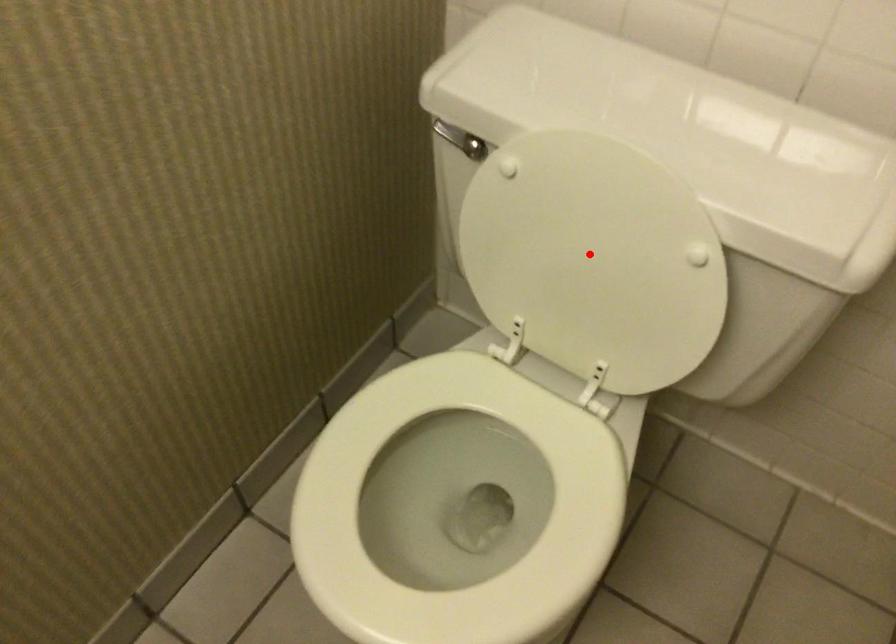
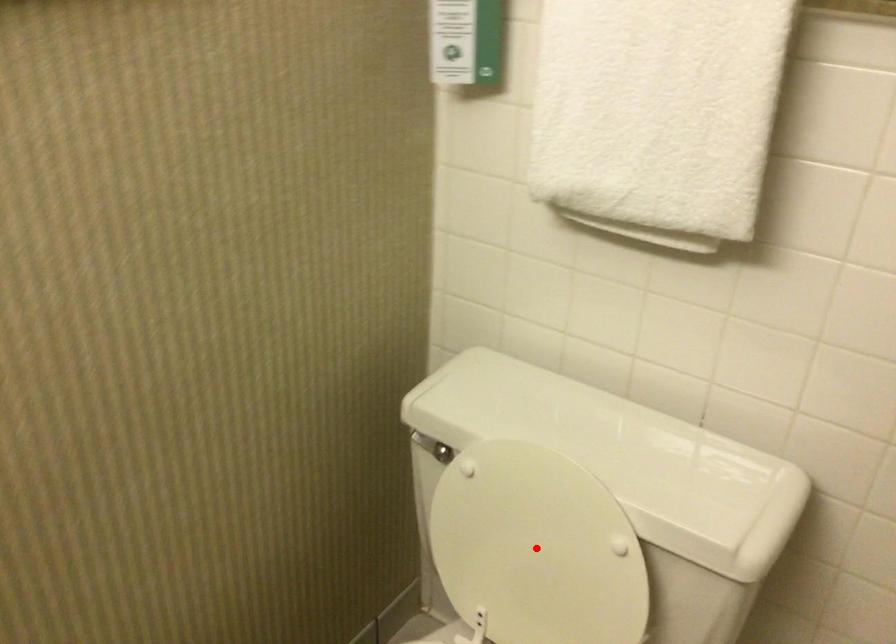
I am providing you with two images of the same scene from different viewpoints. A red point is marked on the first image and another point is marked on the second image. Are the points marked in image1 and image2 representing the same 3D position?

Yes